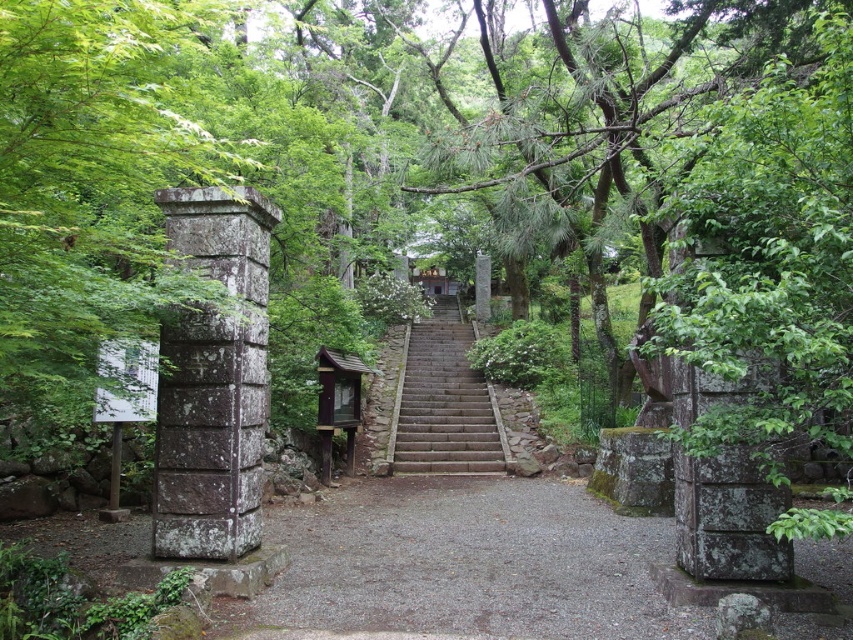
Question: Is the position of gray gravel path at center more distant than that of brown stone stairs at center?

Choices:
 (A) no
 (B) yes

Answer: (A)

Question: Can you confirm if gray gravel path at center is positioned to the left of brown stone stairs at center?

Choices:
 (A) no
 (B) yes

Answer: (B)

Question: Which object is farther from the camera taking this photo?

Choices:
 (A) brown stone stairs at center
 (B) gray gravel path at center

Answer: (A)

Question: Which of the following is the farthest from the observer?

Choices:
 (A) (474, 336)
 (B) (409, 538)

Answer: (A)

Question: Does gray gravel path at center have a larger size compared to brown stone stairs at center?

Choices:
 (A) yes
 (B) no

Answer: (B)